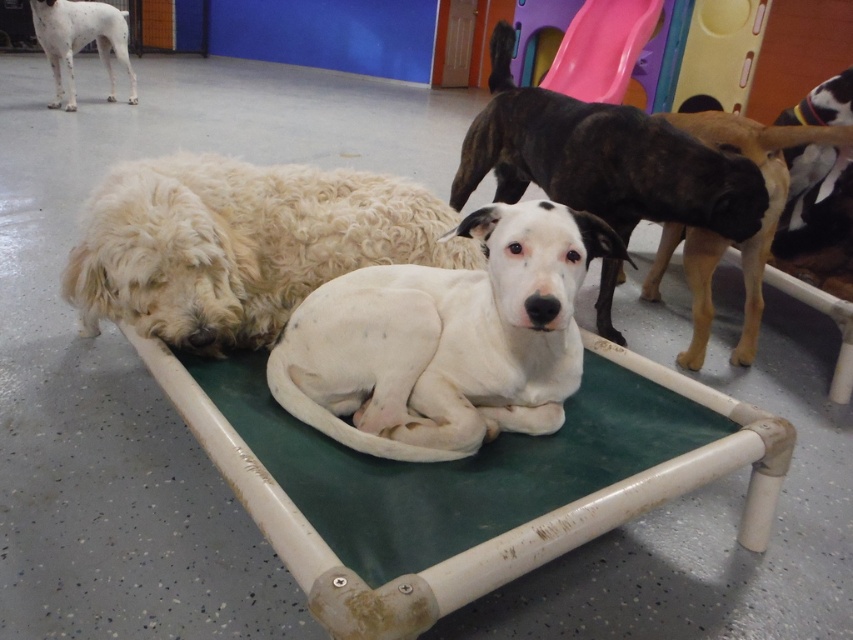
Question: Estimate the real-world distances between objects in this image. Which object is closer to the white smooth dog at center?

Choices:
 (A) white speckled fur at upper left
 (B) white fluffy dog at center
 (C) brindle fur dog at center
 (D) green fabric dog bed at center

Answer: (D)

Question: Which object is closer to the camera taking this photo?

Choices:
 (A) white smooth dog at center
 (B) brindle fur dog at center
 (C) white fluffy dog at center
 (D) green fabric dog bed at center

Answer: (D)

Question: Which point is closer to the camera taking this photo?

Choices:
 (A) (553, 442)
 (B) (844, 112)
 (C) (415, 221)
 (D) (791, 145)

Answer: (A)

Question: Is white fluffy dog at center to the left of white fur dog at upper right from the viewer's perspective?

Choices:
 (A) yes
 (B) no

Answer: (A)

Question: Observing the image, what is the correct spatial positioning of brindle fur dog at center in reference to white speckled fur at upper left?

Choices:
 (A) left
 (B) right

Answer: (B)

Question: Is brindle fur dog at center below white fur dog at upper right?

Choices:
 (A) no
 (B) yes

Answer: (B)